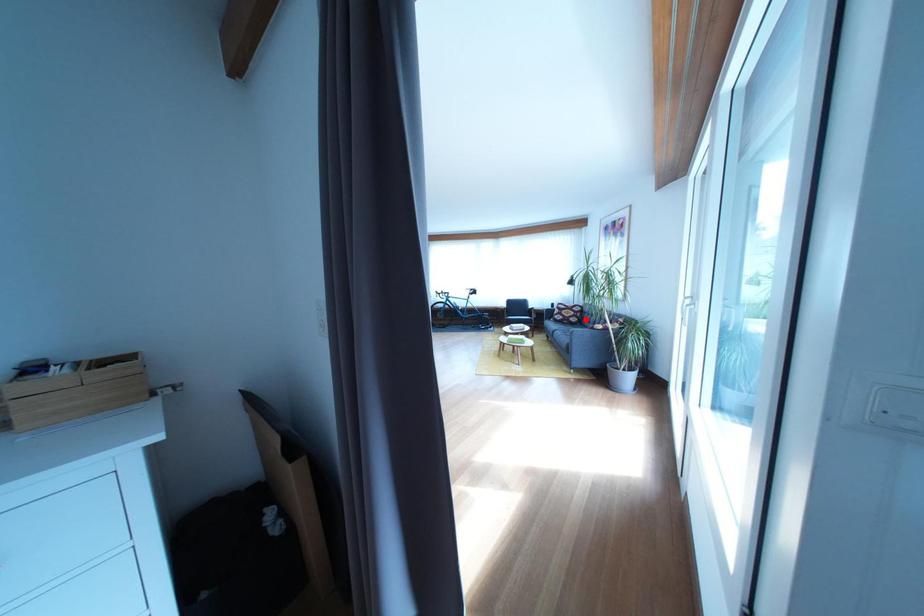
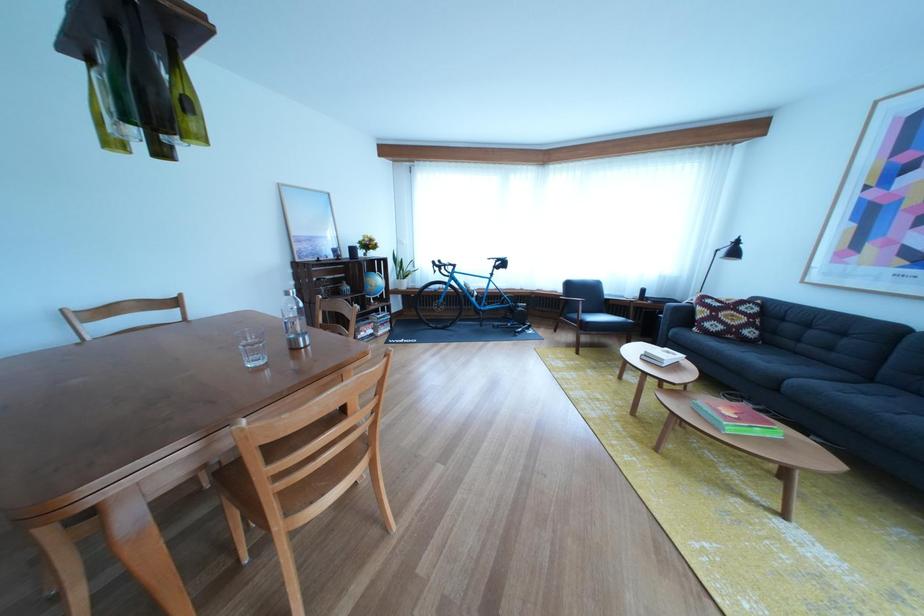
The point at the highlighted location is marked in the first image. Where is the corresponding point in the second image?

(757, 325)